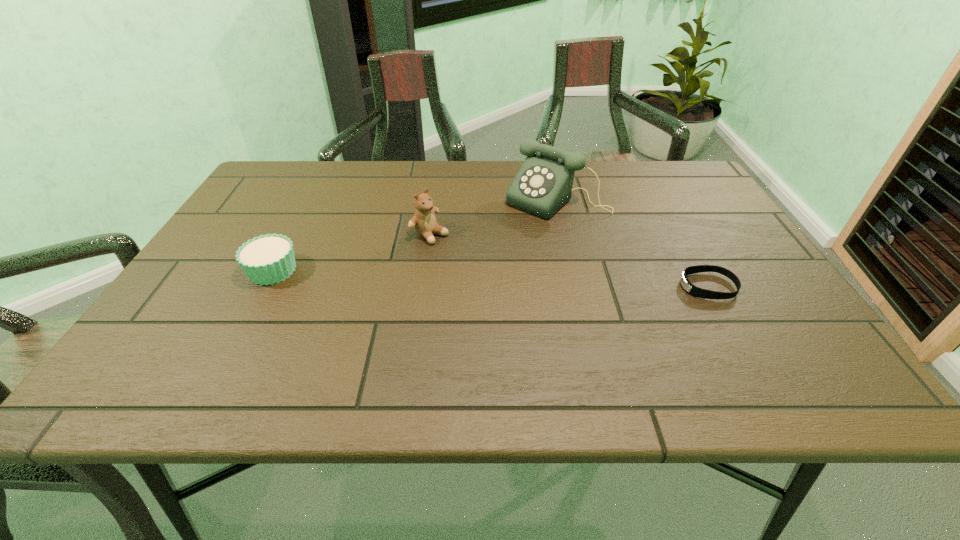
Find the location of a particular element. This screenshot has height=540, width=960. free space located on the display of the wristband is located at coordinates (513, 286).

Locate an element on the screen. Image resolution: width=960 pixels, height=540 pixels. free location located on the display of the wristband is located at coordinates (612, 286).

This screenshot has width=960, height=540. Identify the location of vacant area situated on the front-facing side of the third nearest object. (539, 296).

You are a GUI agent. You are given a task and a screenshot of the screen. Output one action in this format:
    pyautogui.click(x=<x>, y=<y>)
    Task: Click on the vacant space positioned 0.050m on the front-facing side of the third nearest object
    The width and height of the screenshot is (960, 540).
    Given the screenshot: What is the action you would take?
    pyautogui.click(x=458, y=251)

Identify the location of vacant space situated 0.210m on the front-facing side of the third nearest object. The image size is (960, 540). (510, 280).

This screenshot has height=540, width=960. I want to click on vacant area situated on the dial of the second object from right to left, so click(x=489, y=253).

Where is `vacant space located on the dial of the second object from right to left`? The height and width of the screenshot is (540, 960). vacant space located on the dial of the second object from right to left is located at coordinates (484, 257).

The height and width of the screenshot is (540, 960). I want to click on vacant space located on the dial of the second object from right to left, so click(500, 242).

Locate an element on the screen. The image size is (960, 540). object present at the far edge is located at coordinates pos(543,184).

This screenshot has width=960, height=540. Find the location of `object at the left edge`. object at the left edge is located at coordinates (268, 259).